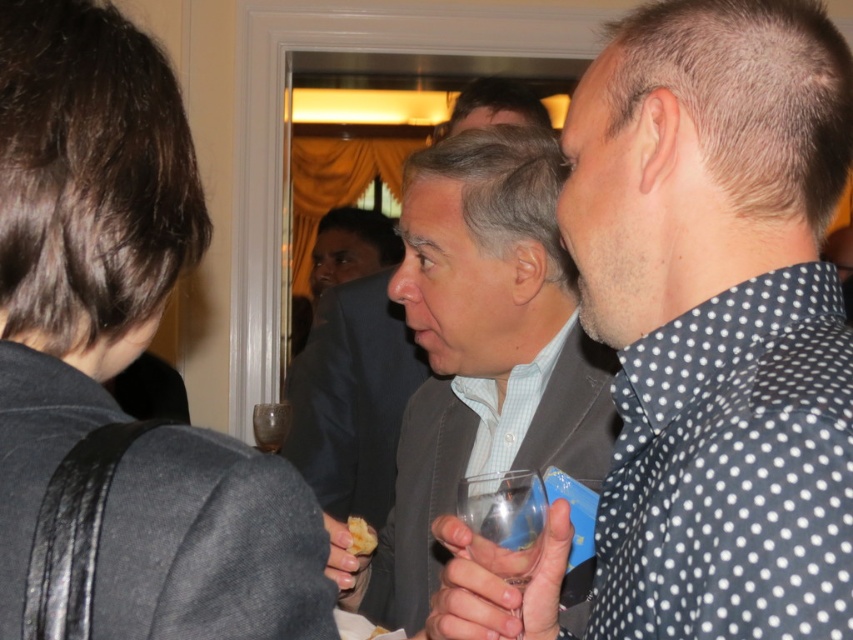
Does matte gray suit at center appear under yellowish matte bread at center?

Actually, matte gray suit at center is above yellowish matte bread at center.

Between point (444, 314) and point (364, 525), which one is positioned behind?

Positioned behind is point (444, 314).

Locate an element on the screen. This screenshot has height=640, width=853. matte gray suit at center is located at coordinates (483, 349).

Is point (561, 522) positioned before point (583, 364)?

That is True.

Can you confirm if gray suit jacket at center is wider than matte gray suit at center?

No, gray suit jacket at center is not wider than matte gray suit at center.

At what (x,y) coordinates should I click in order to perform the action: click on gray suit jacket at center. Please return your answer as a coordinate pair (x, y). Looking at the image, I should click on (717, 317).

Who is positioned more to the right, dark gray fabric at upper left or translucent glass wine glass at center?

dark gray fabric at upper left

Can you confirm if dark gray fabric at upper left is wider than translucent glass wine glass at center?

Incorrect, dark gray fabric at upper left's width does not surpass translucent glass wine glass at center's.

Which is in front, point (20, 157) or point (263, 449)?

Point (20, 157) is in front.

Find the location of a particular element. The height and width of the screenshot is (640, 853). dark gray fabric at upper left is located at coordinates (119, 362).